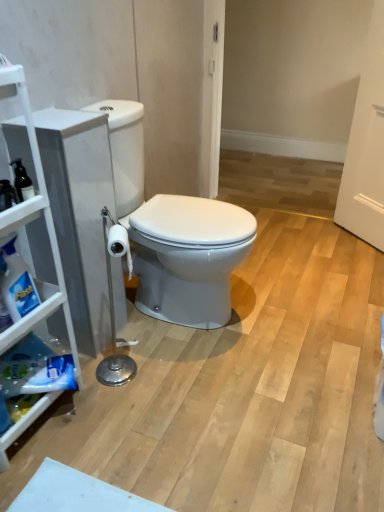
The image size is (384, 512). Find the location of `vacant area that lies to the right of white matte cabinet at left`. vacant area that lies to the right of white matte cabinet at left is located at coordinates (110, 428).